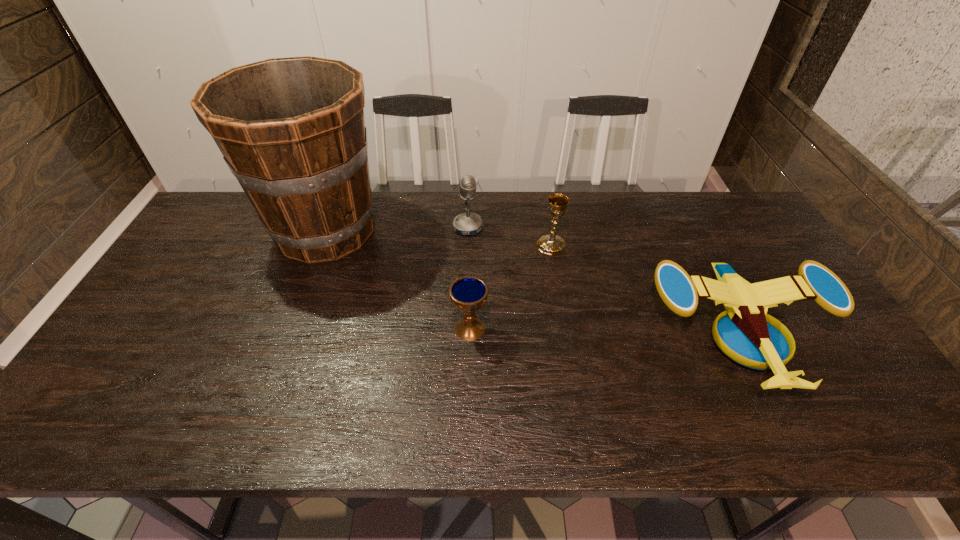
Where is `free space at the right edge`? The width and height of the screenshot is (960, 540). free space at the right edge is located at coordinates (718, 237).

Where is `vacant space at the far right corner of the desktop`? The width and height of the screenshot is (960, 540). vacant space at the far right corner of the desktop is located at coordinates (738, 209).

The image size is (960, 540). In order to click on vacant space in between the microphone and the right chalice in this screenshot , I will do click(510, 237).

The width and height of the screenshot is (960, 540). I want to click on free area in between the leftmost object and the microphone, so click(x=397, y=229).

Image resolution: width=960 pixels, height=540 pixels. I want to click on blank region between the farther chalice and the drone, so click(645, 289).

The width and height of the screenshot is (960, 540). Identify the location of blank region between the bucket and the microphone. (397, 229).

At what (x,y) coordinates should I click in order to perform the action: click on empty location between the farther chalice and the bucket. Please return your answer as a coordinate pair (x, y). Image resolution: width=960 pixels, height=540 pixels. Looking at the image, I should click on 439,238.

Image resolution: width=960 pixels, height=540 pixels. Find the location of `vacant space in between the nearer chalice and the tallest object`. vacant space in between the nearer chalice and the tallest object is located at coordinates (397, 280).

Find the location of a particular element. The height and width of the screenshot is (540, 960). free space between the bucket and the drone is located at coordinates (533, 282).

You are a GUI agent. You are given a task and a screenshot of the screen. Output one action in this format:
    pyautogui.click(x=<x>, y=<y>)
    Task: Click on the free point between the farther chalice and the rightmost object
    This screenshot has height=540, width=960.
    Given the screenshot: What is the action you would take?
    pyautogui.click(x=645, y=289)